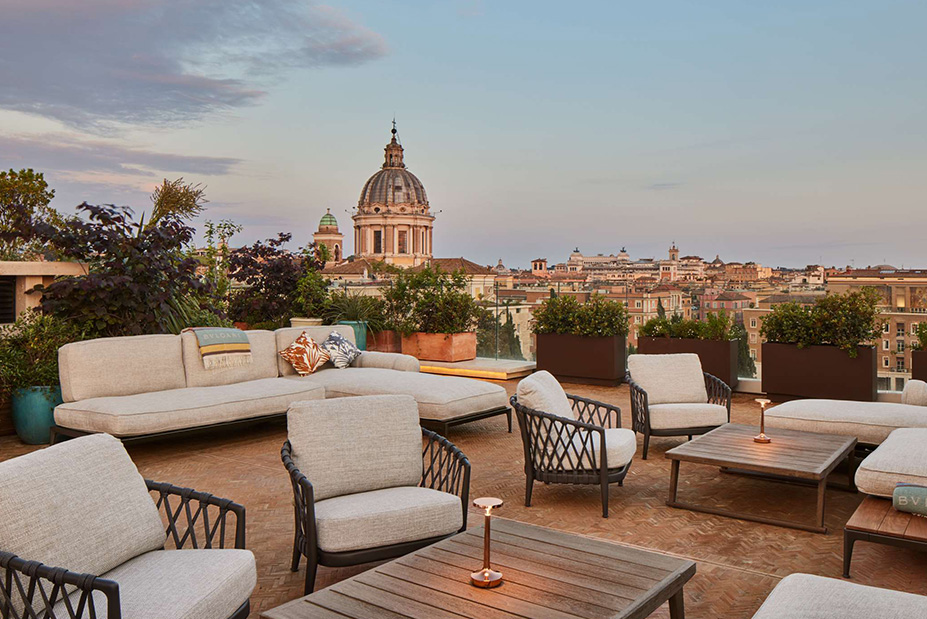
You are a GUI agent. You are given a task and a screenshot of the screen. Output one action in this format:
    pyautogui.click(x=<x>, y=<y>)
    Task: Click on the white and blue pillow
    
    Given the screenshot: What is the action you would take?
    pyautogui.click(x=338, y=343)